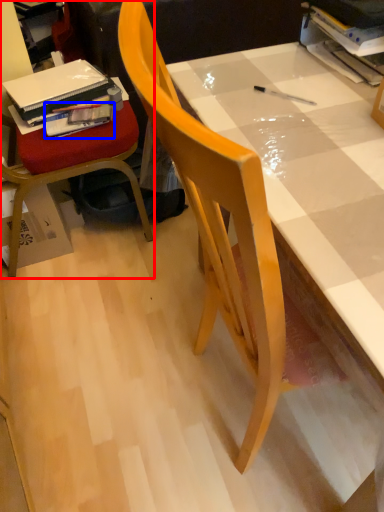
Question: Among these objects, which one is nearest to the camera, chair (highlighted by a red box) or book (highlighted by a blue box)?

Choices:
 (A) chair
 (B) book

Answer: (A)